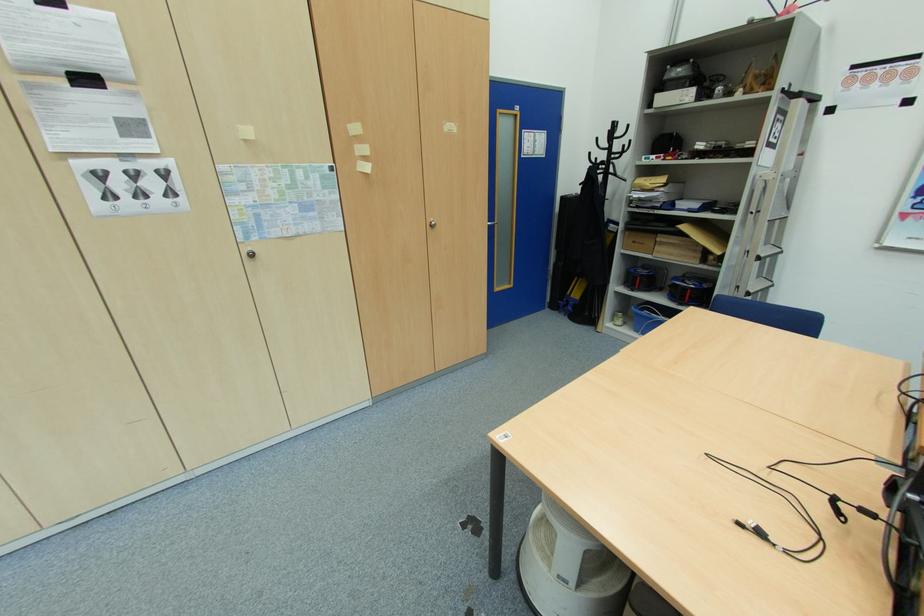
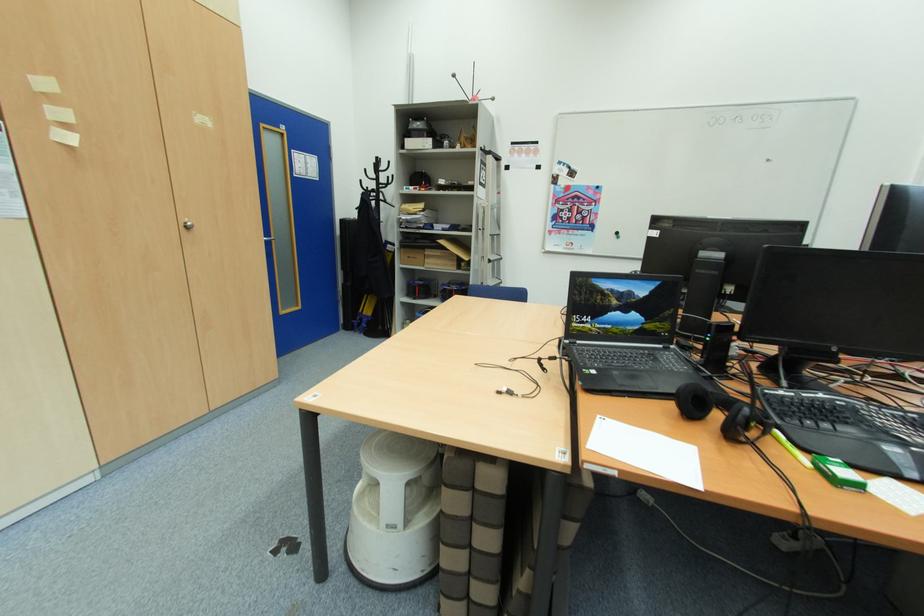
Question: The camera is either moving clockwise (left) or counter-clockwise (right) around the object. The first image is from the beginning of the video and the second image is from the end. Is the camera moving left or right when shooting the video?

Choices:
 (A) Left
 (B) Right

Answer: (A)